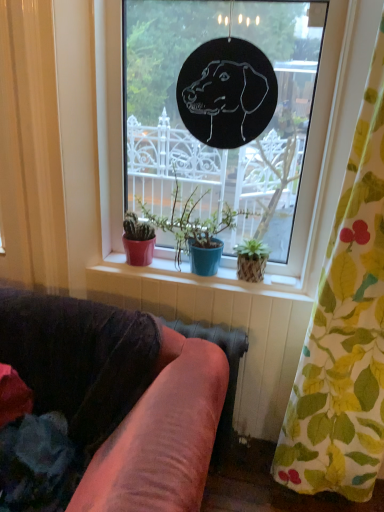
What are the coordinates of `free point above matte ceramic pots at center (from a real-world perspective)` in the screenshot? It's located at (201, 270).